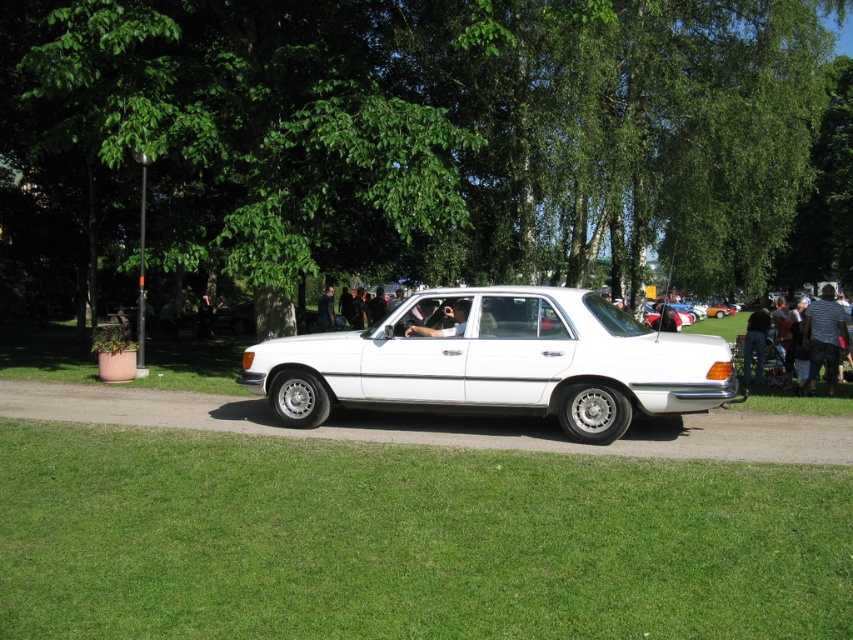
Which is behind, point (498, 618) or point (641, 406)?

The point (641, 406) is behind.

Does green grass at lower center appear on the right side of white glossy sedan at center?

Indeed, green grass at lower center is positioned on the right side of white glossy sedan at center.

You are a GUI agent. You are given a task and a screenshot of the screen. Output one action in this format:
    pyautogui.click(x=<x>, y=<y>)
    Task: Click on the green grass at lower center
    The width and height of the screenshot is (853, 640).
    Given the screenshot: What is the action you would take?
    pyautogui.click(x=407, y=540)

Can you confirm if striped shirt at right is bigger than matte black car door at center?

Correct, striped shirt at right is larger in size than matte black car door at center.

Between striped shirt at right and matte black car door at center, which one has more height?

Standing taller between the two is striped shirt at right.

Who is more distant from viewer, (840, 316) or (463, 314)?

The point (840, 316) is more distant.

This screenshot has width=853, height=640. Find the location of `striped shirt at right`. striped shirt at right is located at coordinates (824, 337).

At what (x,y) coordinates should I click in order to perform the action: click on white glossy sedan at center. Please return your answer as a coordinate pair (x, y). Looking at the image, I should click on (498, 364).

Is point (698, 346) positioned before point (836, 332)?

Yes, it is.

Is point (552, 337) closer to camera compared to point (817, 374)?

Yes, point (552, 337) is closer to viewer.

Where is `white glossy sedan at center`? Image resolution: width=853 pixels, height=640 pixels. white glossy sedan at center is located at coordinates (498, 364).